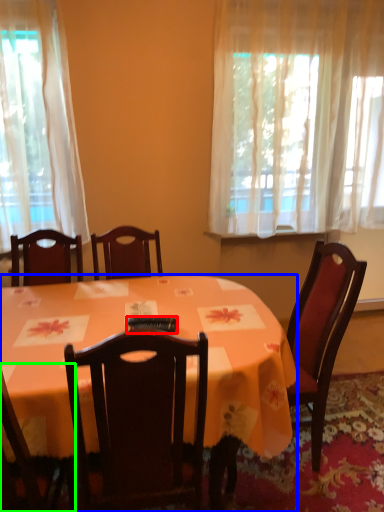
Question: Which is nearer to the remote control (highlighted by a red box)? desk (highlighted by a blue box) or chair (highlighted by a green box).

Choices:
 (A) desk
 (B) chair

Answer: (B)